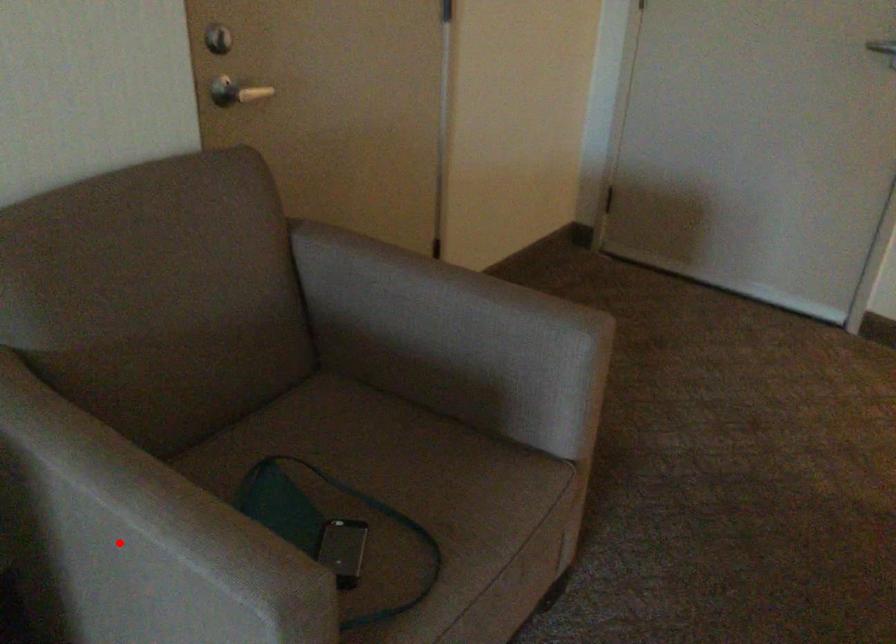
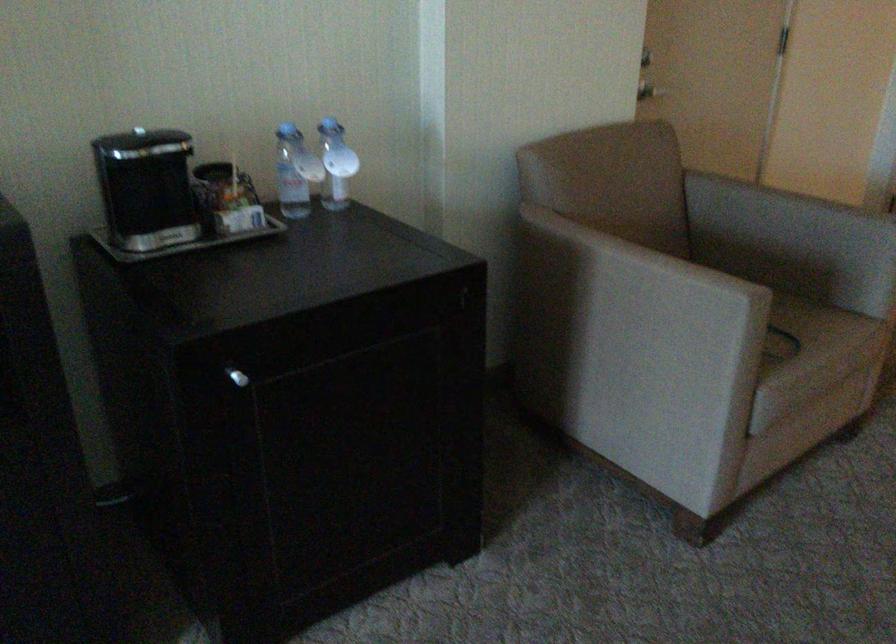
Question: A red point is marked in image1. In image2, is the corresponding 3D point closer to the camera or farther? Reply with the corresponding letter.

Choices:
 (A) The corresponding 3D point is closer.
 (B) The corresponding 3D point is farther.

Answer: (B)